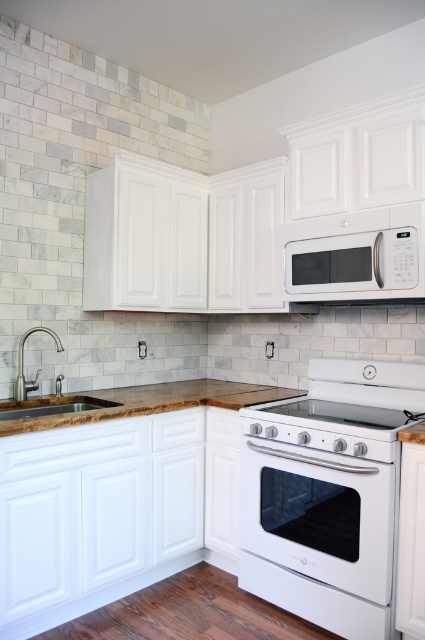
Does wooden countertop at lower left appear on the right side of brushed nickel faucet at left?

Indeed, wooden countertop at lower left is positioned on the right side of brushed nickel faucet at left.

Is wooden countertop at lower left wider than brushed nickel faucet at left?

Correct, the width of wooden countertop at lower left exceeds that of brushed nickel faucet at left.

Which is behind, point (209, 392) or point (33, 385)?

The point (209, 392) is more distant.

What are the coordinates of `wooden countertop at lower left` in the screenshot? It's located at (138, 403).

Is the position of white glossy electric stove at center more distant than that of white glossy stove at center?

No, it is not.

Between point (317, 566) and point (329, 445), which one is positioned behind?

The point (317, 566) is behind.

The width and height of the screenshot is (425, 640). Identify the location of white glossy electric stove at center. (328, 493).

Locate an element on the screen. white glossy electric stove at center is located at coordinates (328, 493).

What do you see at coordinates (328, 493) in the screenshot?
I see `white glossy electric stove at center` at bounding box center [328, 493].

Does point (249, 413) lie in front of point (209, 385)?

Yes, it is.

Who is more forward, (275, 435) or (241, 384)?

Point (275, 435) is in front.

Identify the location of white glossy electric stove at center. The width and height of the screenshot is (425, 640). (328, 493).